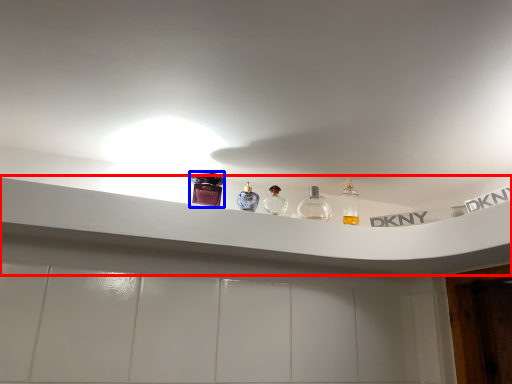
Question: Which of the following is the farthest to the observer, window sill (highlighted by a red box) or toiletry (highlighted by a blue box)?

Choices:
 (A) window sill
 (B) toiletry

Answer: (B)